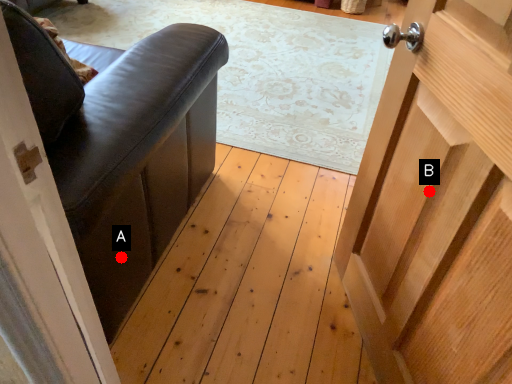
Question: Two points are circled on the image, labeled by A and B beside each circle. Which point appears farthest from the camera in this image?

Choices:
 (A) A is further
 (B) B is further

Answer: (A)